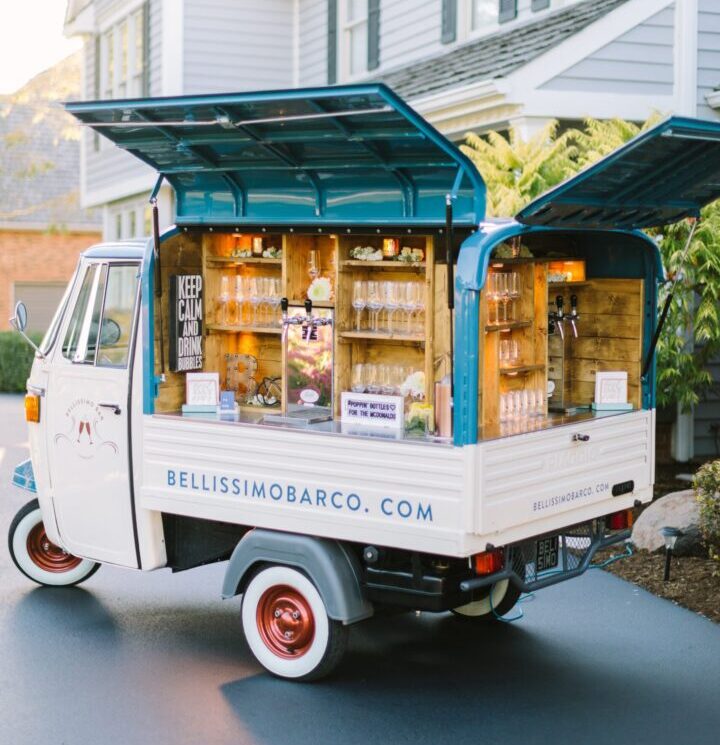
Where is `left door`? The width and height of the screenshot is (720, 745). left door is located at coordinates (68, 454).